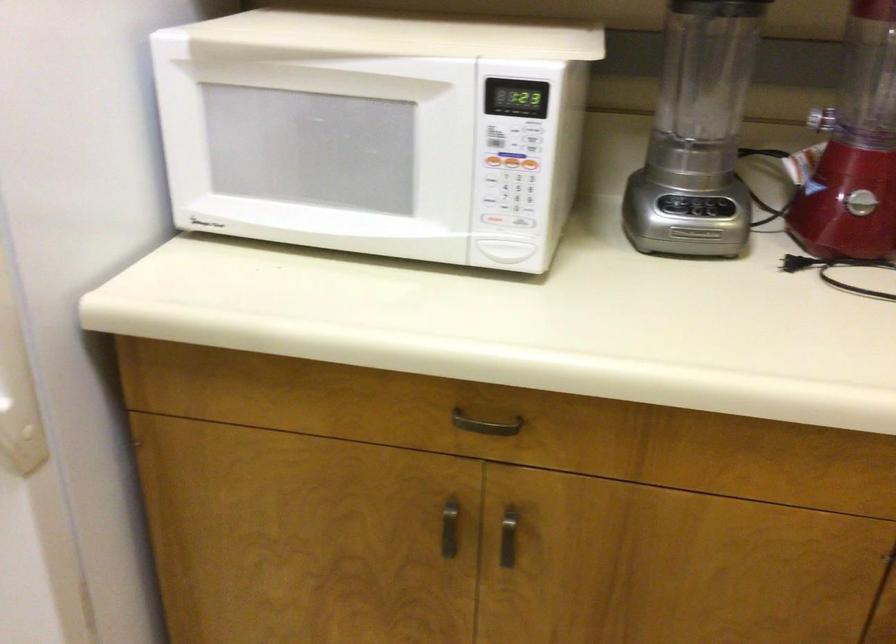
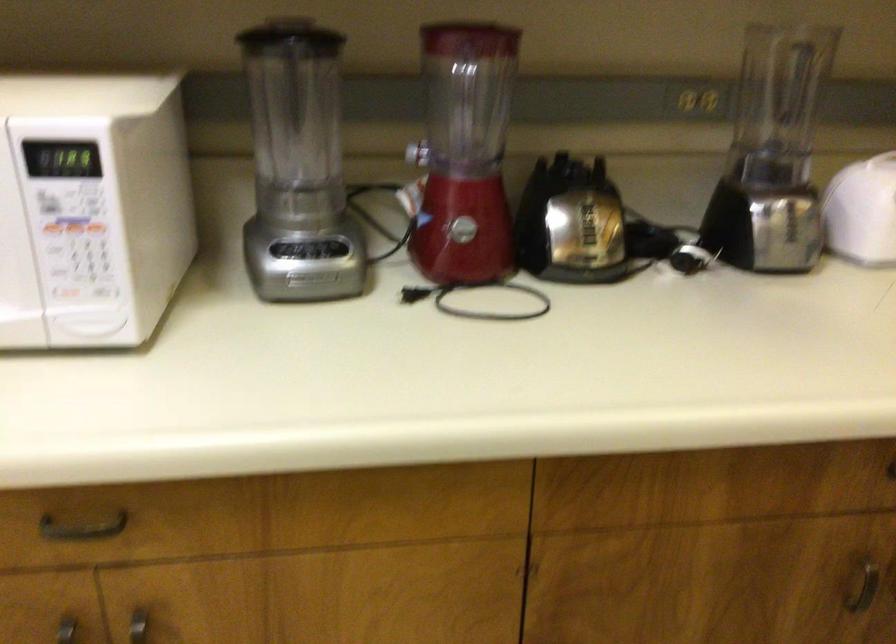
Find the pixel in the second image that matches (x=488, y=424) in the first image.

(82, 527)